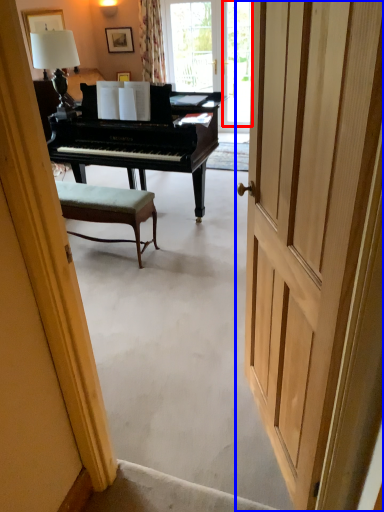
Question: Which object appears closest to the camera in this image, window screen (highlighted by a red box) or door (highlighted by a blue box)?

Choices:
 (A) window screen
 (B) door

Answer: (B)